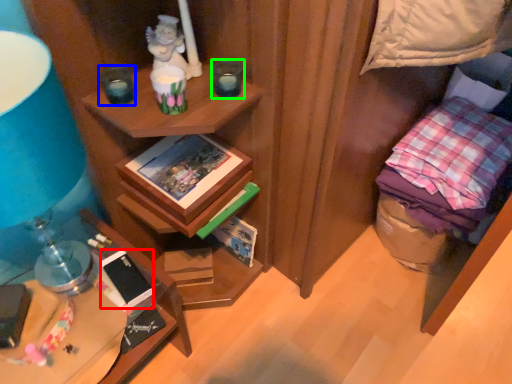
Question: Based on their relative distances, which object is nearer to mobile phone (highlighted by a red box)? Choose from candle holder (highlighted by a blue box) and candle holder (highlighted by a green box).

Choices:
 (A) candle holder
 (B) candle holder

Answer: (A)